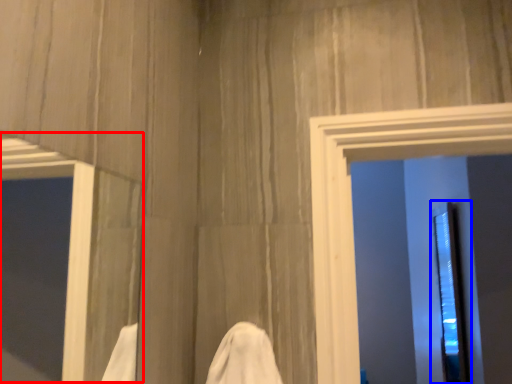
Question: Which object is further to the camera taking this photo, window (highlighted by a red box) or screen door (highlighted by a blue box)?

Choices:
 (A) window
 (B) screen door

Answer: (B)